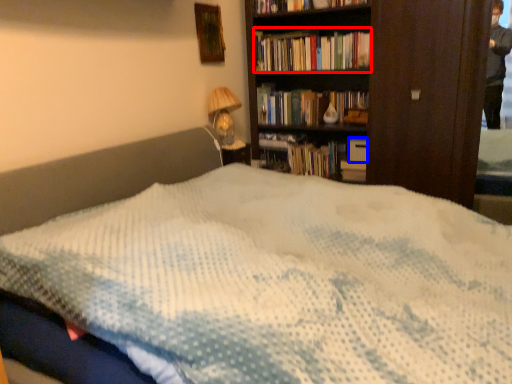
Question: Which object appears farthest to the camera in this image, book (highlighted by a red box) or paperback book (highlighted by a blue box)?

Choices:
 (A) book
 (B) paperback book

Answer: (B)